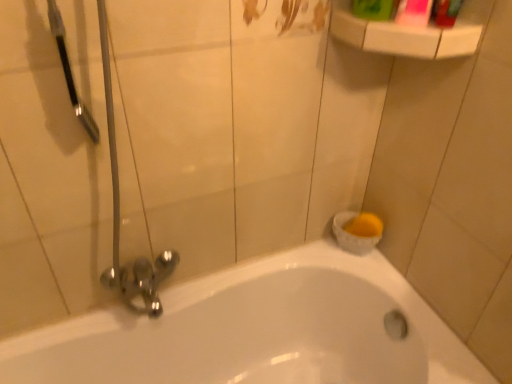
What do you see at coordinates (446, 12) in the screenshot?
I see `green plastic bottle at upper right` at bounding box center [446, 12].

The width and height of the screenshot is (512, 384). What do you see at coordinates (373, 9) in the screenshot?
I see `green plastic mouthwash at upper right, arranged as the second mouthwash when viewed from the right` at bounding box center [373, 9].

What is the approximate width of green plastic mouthwash at upper right, which is counted as the first mouthwash, starting from the left?

green plastic mouthwash at upper right, which is counted as the first mouthwash, starting from the left, is 5.01 inches wide.

I want to click on pink glossy mouthwash at upper right, the first mouthwash viewed from the right, so click(414, 12).

Considering the relative sizes of green plastic bottle at upper right and white plastic shelf at upper right in the image provided, is green plastic bottle at upper right taller than white plastic shelf at upper right?

Correct, green plastic bottle at upper right is much taller as white plastic shelf at upper right.

Based on the photo, does green plastic bottle at upper right have a smaller size compared to white plastic shelf at upper right?

Correct, green plastic bottle at upper right occupies less space than white plastic shelf at upper right.

What's the angular difference between green plastic bottle at upper right and white plastic shelf at upper right's facing directions?

The angular difference between green plastic bottle at upper right and white plastic shelf at upper right is 3.58 degrees.

From the image's perspective, does green plastic bottle at upper right appear higher than white plastic shelf at upper right?

Yes, from the image's perspective, green plastic bottle at upper right is above white plastic shelf at upper right.

Considering the positions of point (426, 6) and point (366, 5), is point (426, 6) closer or farther from the camera than point (366, 5)?

Point (426, 6) is positioned closer to the camera compared to point (366, 5).

Is pink glossy mouthwash at upper right, marked as the second mouthwash in a left-to-right arrangement, taller than green plastic mouthwash at upper right, arranged as the second mouthwash when viewed from the right?

In fact, pink glossy mouthwash at upper right, marked as the second mouthwash in a left-to-right arrangement, may be shorter than green plastic mouthwash at upper right, arranged as the second mouthwash when viewed from the right.

Looking at this image, is the surface of pink glossy mouthwash at upper right, marked as the second mouthwash in a left-to-right arrangement, in direct contact with green plastic mouthwash at upper right, arranged as the second mouthwash when viewed from the right?

Yes, the surface of pink glossy mouthwash at upper right, marked as the second mouthwash in a left-to-right arrangement, is in contact with green plastic mouthwash at upper right, arranged as the second mouthwash when viewed from the right.

Image resolution: width=512 pixels, height=384 pixels. I want to click on mouthwash that is behind the pink glossy mouthwash at upper right, marked as the second mouthwash in a left-to-right arrangement, so click(373, 9).

Considering the sizes of objects white plastic shelf at upper right and pink glossy mouthwash at upper right, marked as the second mouthwash in a left-to-right arrangement, in the image provided, who is smaller, white plastic shelf at upper right or pink glossy mouthwash at upper right, marked as the second mouthwash in a left-to-right arrangement,?

pink glossy mouthwash at upper right, marked as the second mouthwash in a left-to-right arrangement, is smaller.

Considering the sizes of white plastic shelf at upper right and pink glossy mouthwash at upper right, marked as the second mouthwash in a left-to-right arrangement, in the image, is white plastic shelf at upper right taller or shorter than pink glossy mouthwash at upper right, marked as the second mouthwash in a left-to-right arrangement,?

Clearly, white plastic shelf at upper right is shorter compared to pink glossy mouthwash at upper right, marked as the second mouthwash in a left-to-right arrangement.

Is white plastic shelf at upper right thinner than pink glossy mouthwash at upper right, marked as the second mouthwash in a left-to-right arrangement?

Incorrect, the width of white plastic shelf at upper right is not less than that of pink glossy mouthwash at upper right, marked as the second mouthwash in a left-to-right arrangement.

In the image, is green plastic mouthwash at upper right, arranged as the second mouthwash when viewed from the right, on the left side or the right side of white plastic shelf at upper right?

green plastic mouthwash at upper right, arranged as the second mouthwash when viewed from the right, is positioned on white plastic shelf at upper right's left side.

Between green plastic mouthwash at upper right, which is counted as the first mouthwash, starting from the left, and white plastic shelf at upper right, which one has larger size?

white plastic shelf at upper right.

Would you say green plastic mouthwash at upper right, which is counted as the first mouthwash, starting from the left, is inside or outside white plastic shelf at upper right?

green plastic mouthwash at upper right, which is counted as the first mouthwash, starting from the left, is not enclosed by white plastic shelf at upper right.

Could you measure the distance between green plastic mouthwash at upper right, which is counted as the first mouthwash, starting from the left, and white plastic shelf at upper right?

A distance of 3.49 inches exists between green plastic mouthwash at upper right, which is counted as the first mouthwash, starting from the left, and white plastic shelf at upper right.

Considering the sizes of objects white plastic shelf at upper right and green plastic bottle at upper right in the image provided, who is wider, white plastic shelf at upper right or green plastic bottle at upper right?

white plastic shelf at upper right.

Is white plastic shelf at upper right directly adjacent to green plastic bottle at upper right?

Absolutely, white plastic shelf at upper right is next to and touching green plastic bottle at upper right.

Is green plastic bottle at upper right located within white plastic shelf at upper right?

No, green plastic bottle at upper right is not surrounded by white plastic shelf at upper right.

Is white plastic shelf at upper right to the right of green plastic bottle at upper right from the viewer's perspective?

Incorrect, white plastic shelf at upper right is not on the right side of green plastic bottle at upper right.

Is white glossy bathtub at lower center smaller than green plastic mouthwash at upper right, arranged as the second mouthwash when viewed from the right?

Incorrect, white glossy bathtub at lower center is not smaller in size than green plastic mouthwash at upper right, arranged as the second mouthwash when viewed from the right.

Based on the photo, does white glossy bathtub at lower center turn towards green plastic mouthwash at upper right, arranged as the second mouthwash when viewed from the right?

No, white glossy bathtub at lower center is not aimed at green plastic mouthwash at upper right, arranged as the second mouthwash when viewed from the right.

Based on the photo, considering the relative sizes of white glossy bathtub at lower center and green plastic mouthwash at upper right, arranged as the second mouthwash when viewed from the right, in the image provided, is white glossy bathtub at lower center taller than green plastic mouthwash at upper right, arranged as the second mouthwash when viewed from the right,?

Yes.

Is point (47, 338) positioned behind point (376, 23)?

Yes, it is behind point (376, 23).

Is white glossy bathtub at lower center shorter than white plastic shelf at upper right?

No.

From the image's perspective, would you say white glossy bathtub at lower center is positioned over white plastic shelf at upper right?

Actually, white glossy bathtub at lower center appears below white plastic shelf at upper right in the image.

The width and height of the screenshot is (512, 384). I want to click on toiletry above the white plastic shelf at upper right (from the image's perspective), so click(x=446, y=12).

Where is `mouthwash on the right of the green plastic mouthwash at upper right, which is counted as the first mouthwash, starting from the left`? Image resolution: width=512 pixels, height=384 pixels. mouthwash on the right of the green plastic mouthwash at upper right, which is counted as the first mouthwash, starting from the left is located at coordinates (414, 12).

When comparing their distances from pink glossy mouthwash at upper right, marked as the second mouthwash in a left-to-right arrangement, does white glossy bathtub at lower center or white plastic shelf at upper right seem further?

white glossy bathtub at lower center lies further to pink glossy mouthwash at upper right, marked as the second mouthwash in a left-to-right arrangement, than the other object.

When comparing their distances from green plastic bottle at upper right, does white plastic shelf at upper right or green plastic mouthwash at upper right, which is counted as the first mouthwash, starting from the left, seem closer?

white plastic shelf at upper right.

From the image, which object appears to be farther from pink glossy mouthwash at upper right, marked as the second mouthwash in a left-to-right arrangement, white glossy bathtub at lower center or green plastic bottle at upper right?

white glossy bathtub at lower center.

When comparing their distances from white glossy bathtub at lower center, does green plastic mouthwash at upper right, which is counted as the first mouthwash, starting from the left, or pink glossy mouthwash at upper right, marked as the second mouthwash in a left-to-right arrangement, seem closer?

Based on the image, green plastic mouthwash at upper right, which is counted as the first mouthwash, starting from the left, appears to be nearer to white glossy bathtub at lower center.

When comparing their distances from green plastic mouthwash at upper right, arranged as the second mouthwash when viewed from the right, does pink glossy mouthwash at upper right, the first mouthwash viewed from the right, or white glossy bathtub at lower center seem closer?

pink glossy mouthwash at upper right, the first mouthwash viewed from the right.

Considering their positions, is pink glossy mouthwash at upper right, the first mouthwash viewed from the right, positioned further to white glossy bathtub at lower center than green plastic bottle at upper right?

Among the two, green plastic bottle at upper right is located further to white glossy bathtub at lower center.

Estimate the real-world distances between objects in this image. Which object is further from white plastic shelf at upper right, pink glossy mouthwash at upper right, marked as the second mouthwash in a left-to-right arrangement, or green plastic bottle at upper right?

green plastic bottle at upper right lies further to white plastic shelf at upper right than the other object.

When comparing their distances from green plastic mouthwash at upper right, which is counted as the first mouthwash, starting from the left, does white glossy bathtub at lower center or pink glossy mouthwash at upper right, marked as the second mouthwash in a left-to-right arrangement, seem closer?

Based on the image, pink glossy mouthwash at upper right, marked as the second mouthwash in a left-to-right arrangement, appears to be nearer to green plastic mouthwash at upper right, which is counted as the first mouthwash, starting from the left.

This screenshot has width=512, height=384. In order to click on toiletry between green plastic mouthwash at upper right, arranged as the second mouthwash when viewed from the right, and white glossy bathtub at lower center, in the vertical direction in this screenshot , I will do `click(446, 12)`.

In order to click on balustrade between pink glossy mouthwash at upper right, marked as the second mouthwash in a left-to-right arrangement, and white glossy bathtub at lower center vertically in this screenshot , I will do `click(413, 33)`.

This screenshot has height=384, width=512. Identify the location of mouthwash between white plastic shelf at upper right and green plastic bottle at upper right from left to right. (414, 12).

You are a GUI agent. You are given a task and a screenshot of the screen. Output one action in this format:
    pyautogui.click(x=<x>, y=<y>)
    Task: Click on the balustrade between green plastic bottle at upper right and white glossy bathtub at lower center in the up-down direction
    
    Given the screenshot: What is the action you would take?
    pyautogui.click(x=413, y=33)